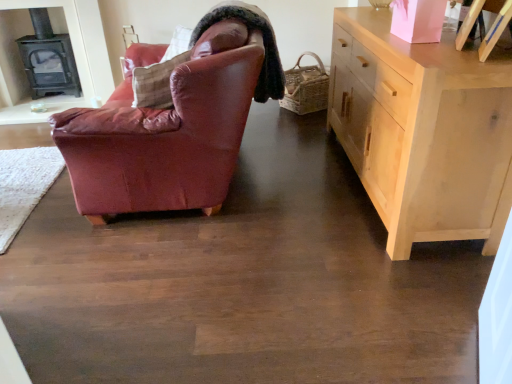
Question: Is light wood cabinet at right bigger or smaller than leather-like brown pillow at upper center?

Choices:
 (A) big
 (B) small

Answer: (A)

Question: Considering the positions of point (388, 231) and point (187, 49), is point (388, 231) closer or farther from the camera than point (187, 49)?

Choices:
 (A) farther
 (B) closer

Answer: (B)

Question: Which is farther from the black cast iron fireplace at upper left?

Choices:
 (A) light wood cabinet at right
 (B) leather-like brown pillow at upper center

Answer: (A)

Question: Which of these objects is positioned closest to the light wood cabinet at right?

Choices:
 (A) leather-like brown pillow at upper center
 (B) black cast iron fireplace at upper left

Answer: (A)